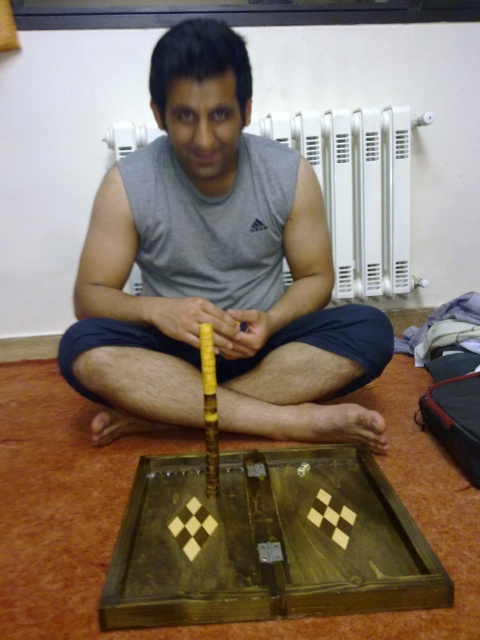
You are a photographer standing 3.45 feet away from the camera. You want to take a photo of the gray matte tank top at center. Can you reach the camera to adjust it?

The gray matte tank top at center and camera are 3.45 feet apart from each other. Since you are already 3.45 feet away from the camera, you can reach the camera to adjust it for the photo.

You are trying to determine which object is wider between the gray matte tank top at center and the white plastic radiator at upper center. Based on the scene description, which one has a greater width?

The gray matte tank top at center has a greater width than the white plastic radiator at upper center according to the description.

You are a home inspector examining a room. You notice the gray matte tank top at center and the white plastic radiator at upper center. Which object is closer to the floor?

The gray matte tank top at center is positioned under the white plastic radiator at upper center, so it is closer to the floor.